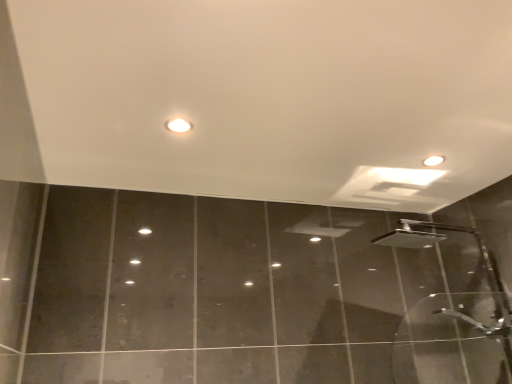
Question: Is matte white droplight at upper center taller or shorter than silver metallic shower head at right?

Choices:
 (A) short
 (B) tall

Answer: (A)

Question: Based on their positions, is matte white droplight at upper center located to the left or right of silver metallic shower head at right?

Choices:
 (A) left
 (B) right

Answer: (A)

Question: From the image's perspective, is matte white droplight at upper center above or below silver metallic shower head at right?

Choices:
 (A) below
 (B) above

Answer: (B)

Question: Is point (420, 238) closer or farther from the camera than point (179, 119)?

Choices:
 (A) closer
 (B) farther

Answer: (B)

Question: Do you think silver metallic shower head at right is within matte white droplight at upper center, or outside of it?

Choices:
 (A) inside
 (B) outside

Answer: (B)

Question: Is silver metallic shower head at right taller or shorter than matte white droplight at upper center?

Choices:
 (A) short
 (B) tall

Answer: (B)

Question: Would you say silver metallic shower head at right is to the left or to the right of matte white droplight at upper center in the picture?

Choices:
 (A) right
 (B) left

Answer: (A)